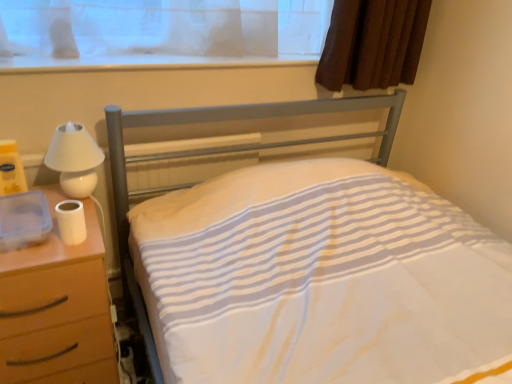
Question: From a real-world perspective, is white plastic window sill at upper center below white matte toilet paper at left?

Choices:
 (A) yes
 (B) no

Answer: (B)

Question: Is white plastic window sill at upper center looking in the opposite direction of white matte toilet paper at left?

Choices:
 (A) yes
 (B) no

Answer: (B)

Question: Can you confirm if white plastic window sill at upper center is shorter than white matte toilet paper at left?

Choices:
 (A) yes
 (B) no

Answer: (A)

Question: Is white plastic window sill at upper center positioned beyond the bounds of white matte toilet paper at left?

Choices:
 (A) no
 (B) yes

Answer: (B)

Question: From a real-world perspective, is white plastic window sill at upper center positioned over white matte toilet paper at left based on gravity?

Choices:
 (A) yes
 (B) no

Answer: (A)

Question: From their relative heights in the image, would you say white plastic window sill at upper center is taller or shorter than white matte nightstand at left?

Choices:
 (A) tall
 (B) short

Answer: (B)

Question: From the image's perspective, is white plastic window sill at upper center above or below white matte nightstand at left?

Choices:
 (A) above
 (B) below

Answer: (A)

Question: Considering the positions of white plastic window sill at upper center and white matte nightstand at left in the image, is white plastic window sill at upper center wider or thinner than white matte nightstand at left?

Choices:
 (A) wide
 (B) thin

Answer: (B)

Question: Considering the positions of white plastic window sill at upper center and white matte nightstand at left in the image, is white plastic window sill at upper center bigger or smaller than white matte nightstand at left?

Choices:
 (A) small
 (B) big

Answer: (A)

Question: Is white matte toilet paper at left inside the boundaries of white glossy lamp at left, or outside?

Choices:
 (A) inside
 (B) outside

Answer: (B)

Question: Considering the positions of white matte toilet paper at left and white glossy lamp at left in the image, is white matte toilet paper at left taller or shorter than white glossy lamp at left?

Choices:
 (A) tall
 (B) short

Answer: (B)

Question: From a real-world perspective, is white matte toilet paper at left physically located above or below white glossy lamp at left?

Choices:
 (A) below
 (B) above

Answer: (A)

Question: Considering the positions of point (74, 206) and point (87, 172), is point (74, 206) closer or farther from the camera than point (87, 172)?

Choices:
 (A) closer
 (B) farther

Answer: (A)

Question: Based on their positions, is white matte toilet paper at left located to the left or right of white plastic window sill at upper center?

Choices:
 (A) left
 (B) right

Answer: (A)

Question: From a real-world perspective, is white matte toilet paper at left positioned above or below white plastic window sill at upper center?

Choices:
 (A) above
 (B) below

Answer: (B)